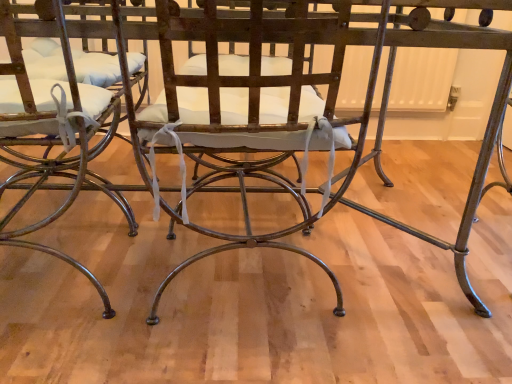
Question: Should I look upward or downward to see matte metal chair at left?

Choices:
 (A) down
 (B) up

Answer: (B)